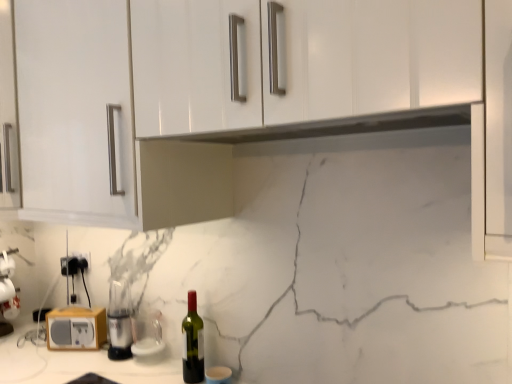
Question: Is green glass bottle at center further to the viewer compared to wooden radio at lower left, the third appliance when ordered from right to left?

Choices:
 (A) no
 (B) yes

Answer: (A)

Question: Is green glass bottle at center facing towards wooden radio at lower left, the third appliance when ordered from right to left?

Choices:
 (A) no
 (B) yes

Answer: (A)

Question: From the image's perspective, is green glass bottle at center on top of wooden radio at lower left, acting as the first appliance starting from the left?

Choices:
 (A) no
 (B) yes

Answer: (B)

Question: Would you say wooden radio at lower left, the third appliance when ordered from right to left, is part of green glass bottle at center's contents?

Choices:
 (A) yes
 (B) no

Answer: (B)

Question: From the image's perspective, is green glass bottle at center below wooden radio at lower left, acting as the first appliance starting from the left?

Choices:
 (A) no
 (B) yes

Answer: (A)

Question: Does green glass bottle at center have a larger size compared to wooden radio at lower left, the third appliance when ordered from right to left?

Choices:
 (A) no
 (B) yes

Answer: (B)

Question: Does black plastic electric outlet at lower left, which is the first electric outlet in right-to-left order, appear on the right side of transparent glass at lower center, arranged as the third appliance when viewed from the left?

Choices:
 (A) yes
 (B) no

Answer: (B)

Question: Could transparent glass at lower center, arranged as the third appliance when viewed from the left, be considered to be inside black plastic electric outlet at lower left, which is the first electric outlet in right-to-left order?

Choices:
 (A) no
 (B) yes

Answer: (A)

Question: From a real-world perspective, is black plastic electric outlet at lower left, which appears as the 2th electric outlet when viewed from the left, physically above transparent glass at lower center, arranged as the third appliance when viewed from the left?

Choices:
 (A) no
 (B) yes

Answer: (B)

Question: Does black plastic electric outlet at lower left, which is the first electric outlet in right-to-left order, have a lesser height compared to transparent glass at lower center, arranged as the third appliance when viewed from the left?

Choices:
 (A) yes
 (B) no

Answer: (A)

Question: Is black plastic electric outlet at lower left, which is the first electric outlet in right-to-left order, outside of transparent glass at lower center, arranged as the third appliance when viewed from the left?

Choices:
 (A) yes
 (B) no

Answer: (A)

Question: Considering the relative sizes of black plastic electric outlet at lower left, which is the first electric outlet in right-to-left order, and transparent glass at lower center, arranged as the third appliance when viewed from the left, in the image provided, is black plastic electric outlet at lower left, which is the first electric outlet in right-to-left order, wider than transparent glass at lower center, arranged as the third appliance when viewed from the left,?

Choices:
 (A) yes
 (B) no

Answer: (B)

Question: Can you confirm if black plastic electric outlet at lower left, the 1th electric outlet in the left-to-right sequence, is shorter than green glass bottle at center?

Choices:
 (A) no
 (B) yes

Answer: (B)